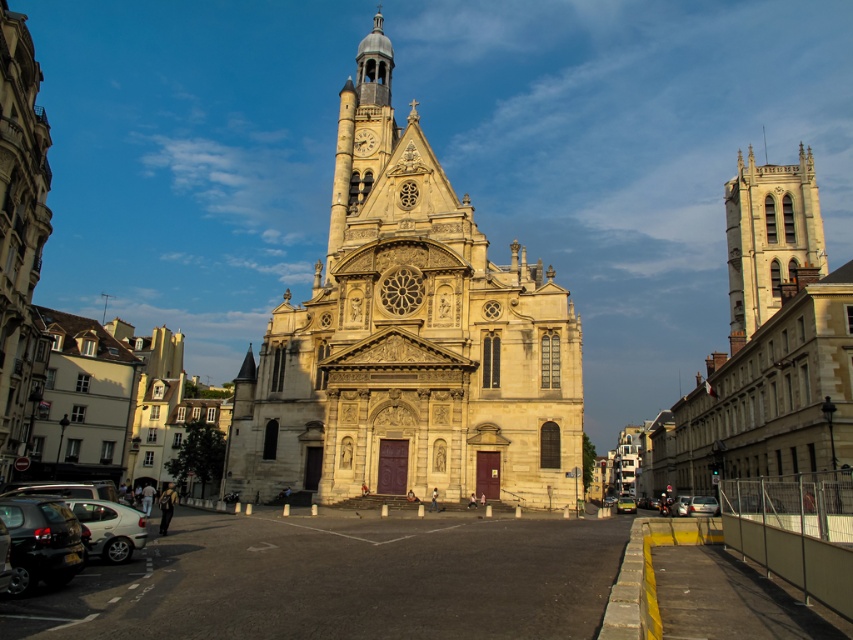
Does stone gothic tower at right have a smaller size compared to metallic silver car at center?

Actually, stone gothic tower at right might be larger than metallic silver car at center.

In the scene shown: Is stone gothic tower at right positioned at the back of metallic silver car at center?

That is True.

Does point (737, 212) come farther from viewer compared to point (682, 513)?

Yes, it is.

This screenshot has width=853, height=640. I want to click on stone gothic tower at right, so click(x=769, y=236).

Between stone gothic tower at right and yellow matte taxi at center, which one is positioned higher?

Positioned higher is stone gothic tower at right.

Does stone gothic tower at right appear on the left side of yellow matte taxi at center?

Incorrect, stone gothic tower at right is not on the left side of yellow matte taxi at center.

Is point (751, 161) positioned after point (619, 509)?

That is True.

Find the location of `stone gothic tower at right`. stone gothic tower at right is located at coordinates (769, 236).

Does light beige stone church at center come in front of silver metallic hatchback at lower left?

No, it is not.

Is light beige stone church at center to the right of silver metallic hatchback at lower left from the viewer's perspective?

Indeed, light beige stone church at center is positioned on the right side of silver metallic hatchback at lower left.

Which is in front, point (352, 252) or point (90, 500)?

Point (90, 500)

This screenshot has height=640, width=853. I want to click on light beige stone church at center, so point(409,340).